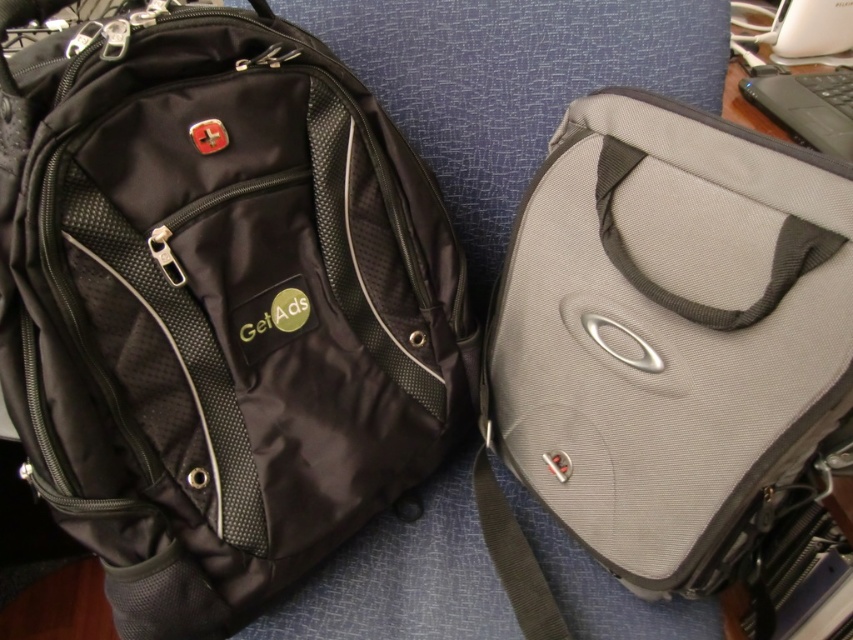
Question: Which is nearer to the gray fabric laptop case at right?

Choices:
 (A) black nylon strap at center
 (B) gray fabric strap at center
 (C) black matte laptop at upper right

Answer: (B)

Question: Can you confirm if gray fabric laptop case at right is positioned to the right of black nylon strap at center?

Choices:
 (A) no
 (B) yes

Answer: (B)

Question: Does black nylon strap at center have a greater width compared to black matte laptop at upper right?

Choices:
 (A) no
 (B) yes

Answer: (A)

Question: Is matte black backpack at left positioned at the back of gray fabric strap at center?

Choices:
 (A) yes
 (B) no

Answer: (A)

Question: Which point appears closest to the camera in this image?

Choices:
 (A) (624, 163)
 (B) (56, 193)
 (C) (758, 198)

Answer: (B)

Question: Considering the real-world distances, which object is farthest from the gray fabric laptop case at right?

Choices:
 (A) matte black backpack at left
 (B) black nylon strap at center

Answer: (A)